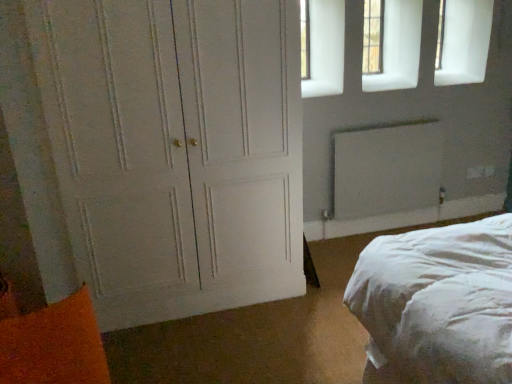
Question: Is white painted wood door at left at the left side of orange fuzzy pillow at lower left?

Choices:
 (A) no
 (B) yes

Answer: (A)

Question: Is white painted wood door at left behind orange fuzzy pillow at lower left?

Choices:
 (A) yes
 (B) no

Answer: (A)

Question: Would you say white painted wood door at left is outside orange fuzzy pillow at lower left?

Choices:
 (A) yes
 (B) no

Answer: (A)

Question: Would you consider white painted wood door at left to be distant from orange fuzzy pillow at lower left?

Choices:
 (A) yes
 (B) no

Answer: (B)

Question: Considering the relative sizes of white painted wood door at left and orange fuzzy pillow at lower left in the image provided, is white painted wood door at left wider than orange fuzzy pillow at lower left?

Choices:
 (A) yes
 (B) no

Answer: (A)

Question: Is white painted wood door at left closer to the viewer compared to orange fuzzy pillow at lower left?

Choices:
 (A) no
 (B) yes

Answer: (A)

Question: Is white matte radiator at upper right wider than orange fuzzy pillow at lower left?

Choices:
 (A) no
 (B) yes

Answer: (A)

Question: Is orange fuzzy pillow at lower left inside white matte radiator at upper right?

Choices:
 (A) no
 (B) yes

Answer: (A)

Question: Can you see white matte radiator at upper right touching orange fuzzy pillow at lower left?

Choices:
 (A) yes
 (B) no

Answer: (B)

Question: Is white matte radiator at upper right further to camera compared to orange fuzzy pillow at lower left?

Choices:
 (A) no
 (B) yes

Answer: (B)

Question: Is white matte radiator at upper right positioned beyond the bounds of orange fuzzy pillow at lower left?

Choices:
 (A) yes
 (B) no

Answer: (A)

Question: From a real-world perspective, is white matte radiator at upper right below orange fuzzy pillow at lower left?

Choices:
 (A) no
 (B) yes

Answer: (A)

Question: From a real-world perspective, is white matte radiator at upper right under white painted wood door at left?

Choices:
 (A) yes
 (B) no

Answer: (A)